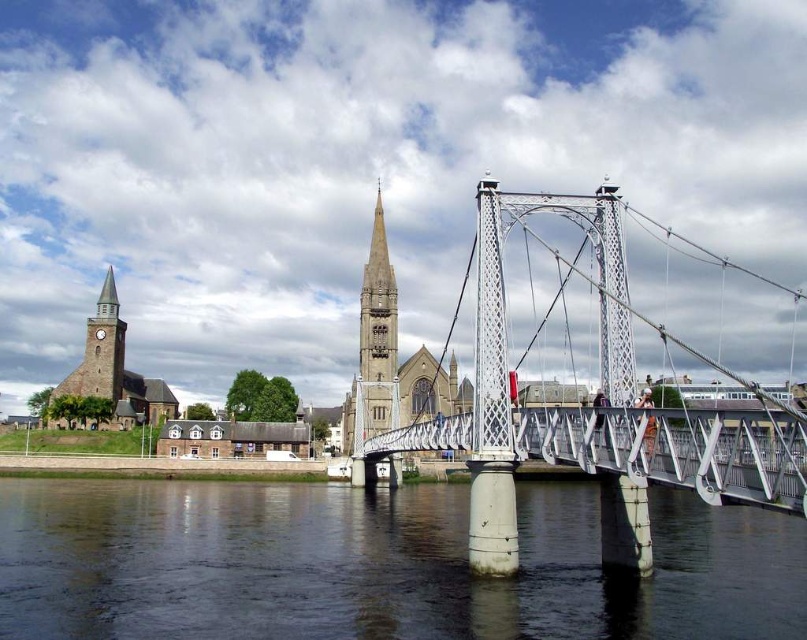
Does white metallic suspension bridge at center have a smaller size compared to white metallic pedestrian bridge at center?

No.

Does white metallic suspension bridge at center have a greater height compared to white metallic pedestrian bridge at center?

Indeed, white metallic suspension bridge at center has a greater height compared to white metallic pedestrian bridge at center.

Which is behind, point (368, 460) or point (760, 449)?

Positioned behind is point (368, 460).

The height and width of the screenshot is (640, 807). Find the location of `white metallic suspension bridge at center`. white metallic suspension bridge at center is located at coordinates (592, 413).

Is white metallic pedestrian bridge at center wider than brown stone church at left?

Indeed, white metallic pedestrian bridge at center has a greater width compared to brown stone church at left.

Locate an element on the screen. The width and height of the screenshot is (807, 640). white metallic pedestrian bridge at center is located at coordinates (674, 449).

Looking at this image, who is more distant from viewer, (728, 454) or (105, 291)?

The point (105, 291) is more distant.

You are a GUI agent. You are given a task and a screenshot of the screen. Output one action in this format:
    pyautogui.click(x=<x>, y=<y>)
    Task: Click on the white metallic pedestrian bridge at center
    
    Given the screenshot: What is the action you would take?
    [x=674, y=449]

Who is positioned more to the right, white metallic suspension bridge at center or brown stone church at left?

Positioned to the right is white metallic suspension bridge at center.

The image size is (807, 640). Find the location of `white metallic suspension bridge at center`. white metallic suspension bridge at center is located at coordinates (592, 413).

You are a GUI agent. You are given a task and a screenshot of the screen. Output one action in this format:
    pyautogui.click(x=<x>, y=<y>)
    Task: Click on the white metallic suspension bridge at center
    
    Given the screenshot: What is the action you would take?
    pyautogui.click(x=592, y=413)

Identify the location of white metallic suspension bridge at center. (592, 413).